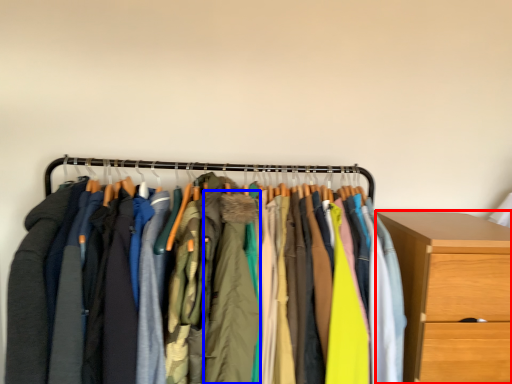
Question: Which point is further to the camera, chest of drawers (highlighted by a red box) or clothing (highlighted by a blue box)?

Choices:
 (A) chest of drawers
 (B) clothing

Answer: (A)